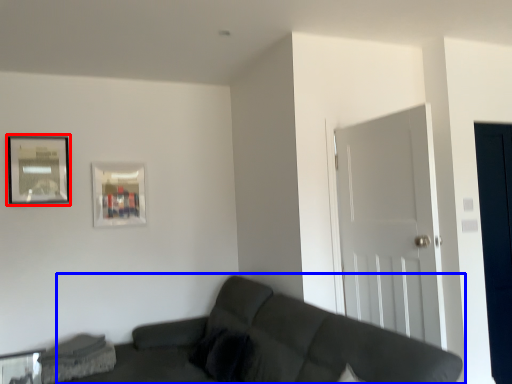
Question: Among these objects, which one is farthest to the camera, picture frame (highlighted by a red box) or studio couch (highlighted by a blue box)?

Choices:
 (A) picture frame
 (B) studio couch

Answer: (A)